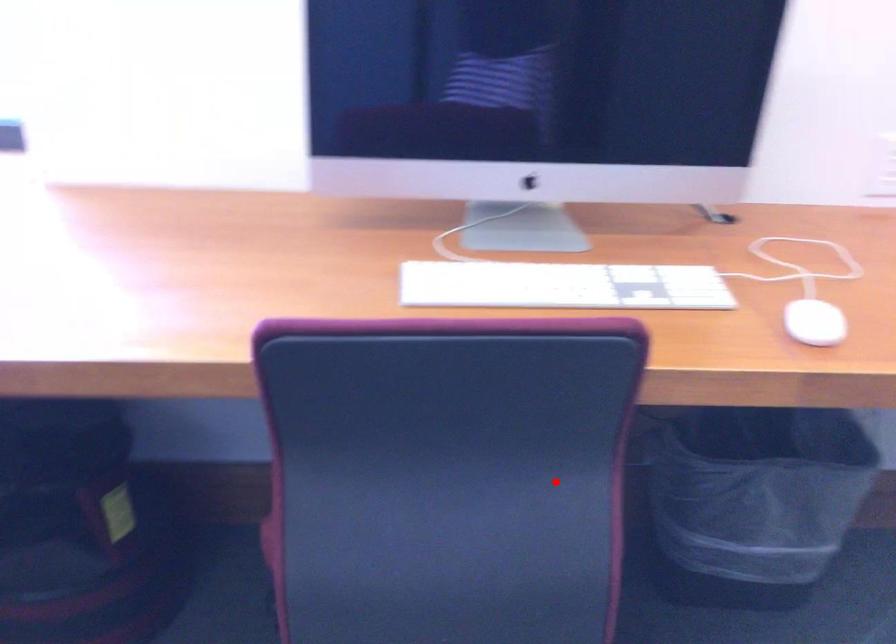
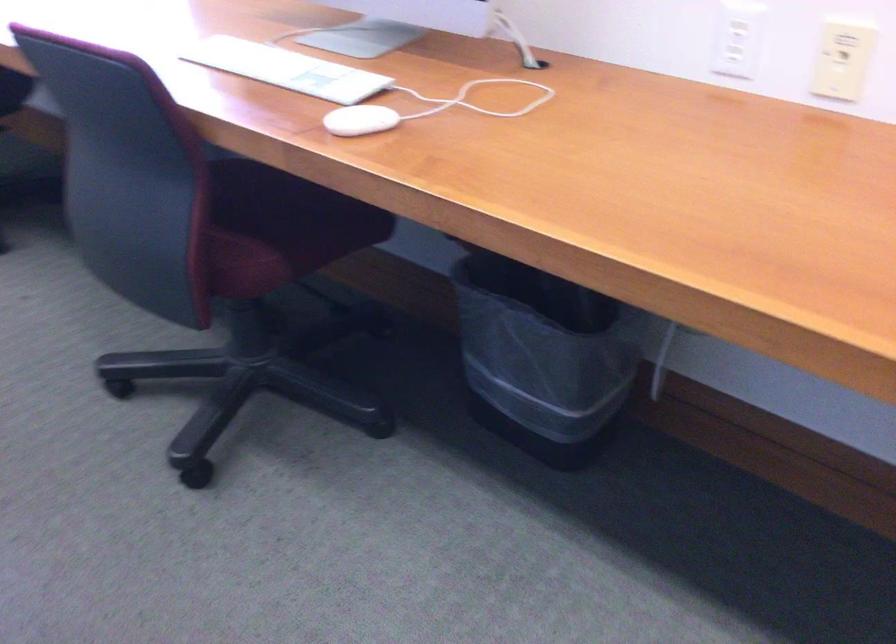
Question: I am providing you with two images of the same scene from different viewpoints. Given a red point in image1, look at the same physical point in image2. Is it:

Choices:
 (A) Closer to the viewpoint
 (B) Farther from the viewpoint

Answer: (B)